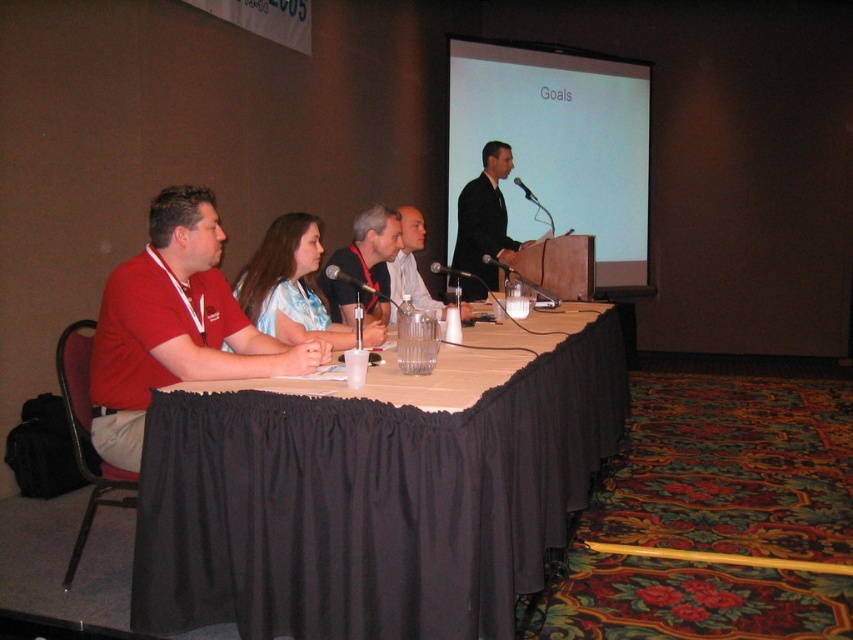
Does matte red shirt at left appear under matte black shirt at center?

Yes.

Who is shorter, matte red shirt at left or matte black shirt at center?

matte black shirt at center is shorter.

Which is in front, point (218, 248) or point (415, 211)?

Point (218, 248) is more forward.

The image size is (853, 640). What are the coordinates of `matte red shirt at left` in the screenshot? It's located at (173, 324).

Can you confirm if black fabric table at center is bigger than matte white shirt at center?

Indeed, black fabric table at center has a larger size compared to matte white shirt at center.

Is point (451, 506) less distant than point (341, 300)?

Yes, point (451, 506) is closer to viewer.

Between point (376, 499) and point (363, 241), which one is positioned in front?

Point (376, 499) is more forward.

Locate an element on the screen. This screenshot has height=640, width=853. black fabric table at center is located at coordinates (369, 500).

Between point (369, 573) and point (415, 232), which one is positioned in front?

Point (369, 573) is more forward.

In the scene shown: Can you confirm if black fabric table at center is bigger than matte black shirt at center?

Correct, black fabric table at center is larger in size than matte black shirt at center.

Identify the location of black fabric table at center. (369, 500).